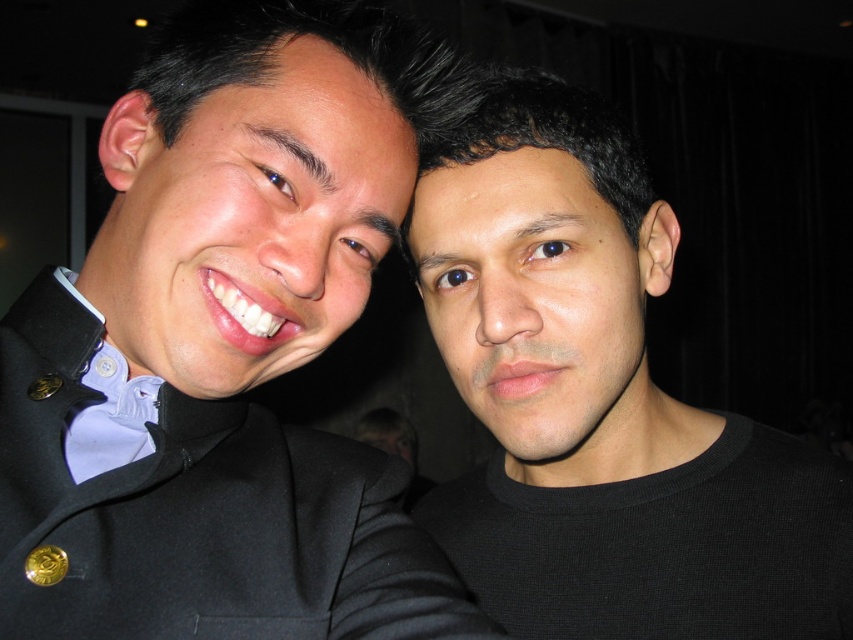
Is black matte suit at left below black matte shirt at right?

No.

Does black matte suit at left have a lesser width compared to black matte shirt at right?

Indeed, black matte suit at left has a lesser width compared to black matte shirt at right.

Measure the distance between black matte suit at left and camera.

16.72 inches

The height and width of the screenshot is (640, 853). What are the coordinates of `black matte suit at left` in the screenshot? It's located at (224, 348).